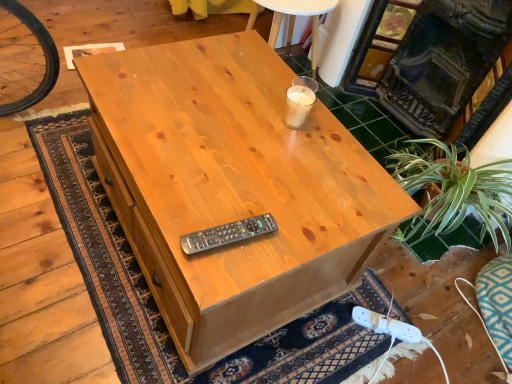
Locate an element on the screen. free space on the front side of white plastic plug at lower right is located at coordinates pyautogui.click(x=378, y=360).